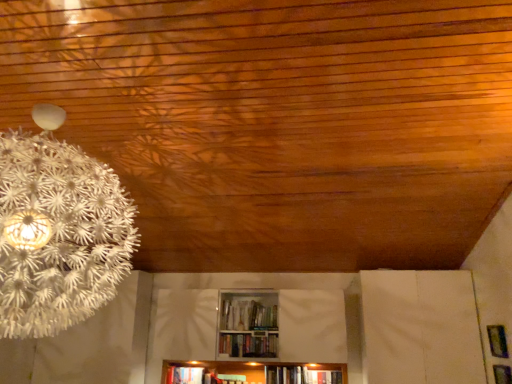
Question: Would you say hardcover book at center, the 1th book from the top, is to the left or to the right of metallic silver frame at lower right in the picture?

Choices:
 (A) right
 (B) left

Answer: (B)

Question: Looking at the image, does hardcover book at center, marked as the 1th book in a right-to-left arrangement, seem bigger or smaller compared to metallic silver frame at lower right?

Choices:
 (A) small
 (B) big

Answer: (B)

Question: Which of these objects is positioned farthest from the hardcover book at center, marked as the 1th book in a right-to-left arrangement?

Choices:
 (A) metallic silver frame at lower right
 (B) hardcover book at lower center, the 1th book when ordered from left to right

Answer: (A)

Question: Estimate the real-world distances between objects in this image. Which object is farther from the hardcover book at lower center, the second book from the right?

Choices:
 (A) hardcover book at center, arranged as the 2th book when ordered from the bottom
 (B) metallic silver frame at lower right

Answer: (B)